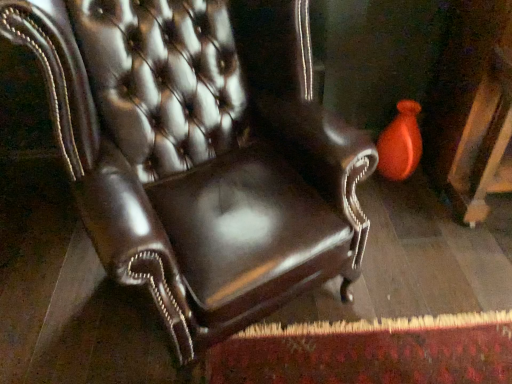
The image size is (512, 384). Identify the location of vacant area that is situated to the right of shiny leather chair at center. (407, 291).